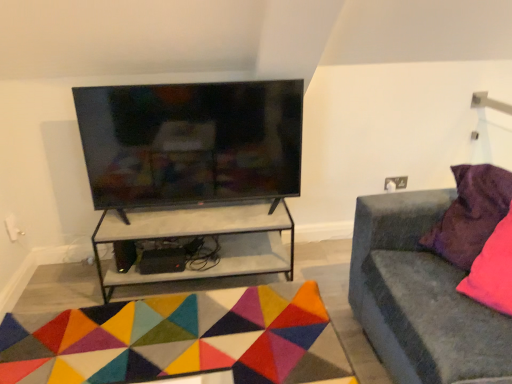
Question: From the image's perspective, does multicolored felt mat at center appear higher than black glossy tv at upper center?

Choices:
 (A) no
 (B) yes

Answer: (A)

Question: From a real-world perspective, is multicolored felt mat at center positioned under black glossy tv at upper center based on gravity?

Choices:
 (A) no
 (B) yes

Answer: (B)

Question: Considering the relative positions of multicolored felt mat at center and black glossy tv at upper center in the image provided, is multicolored felt mat at center in front of black glossy tv at upper center?

Choices:
 (A) no
 (B) yes

Answer: (B)

Question: Can you confirm if multicolored felt mat at center is bigger than black glossy tv at upper center?

Choices:
 (A) yes
 (B) no

Answer: (B)

Question: Is multicolored felt mat at center completely or partially outside of black glossy tv at upper center?

Choices:
 (A) yes
 (B) no

Answer: (A)

Question: Does multicolored felt mat at center have a greater width compared to black glossy tv at upper center?

Choices:
 (A) yes
 (B) no

Answer: (A)

Question: Is purple velvet pillow at right with multicolored felt mat at center?

Choices:
 (A) yes
 (B) no

Answer: (B)

Question: Can you confirm if purple velvet pillow at right is positioned to the left of multicolored felt mat at center?

Choices:
 (A) no
 (B) yes

Answer: (A)

Question: Is multicolored felt mat at center completely or partially inside purple velvet pillow at right?

Choices:
 (A) no
 (B) yes

Answer: (A)

Question: Is the position of purple velvet pillow at right more distant than that of multicolored felt mat at center?

Choices:
 (A) yes
 (B) no

Answer: (B)

Question: Can you confirm if purple velvet pillow at right is wider than multicolored felt mat at center?

Choices:
 (A) no
 (B) yes

Answer: (A)

Question: From the image's perspective, would you say purple velvet pillow at right is shown under multicolored felt mat at center?

Choices:
 (A) no
 (B) yes

Answer: (A)

Question: Is velvet grey couch at right turned away from multicolored felt mat at center?

Choices:
 (A) yes
 (B) no

Answer: (B)